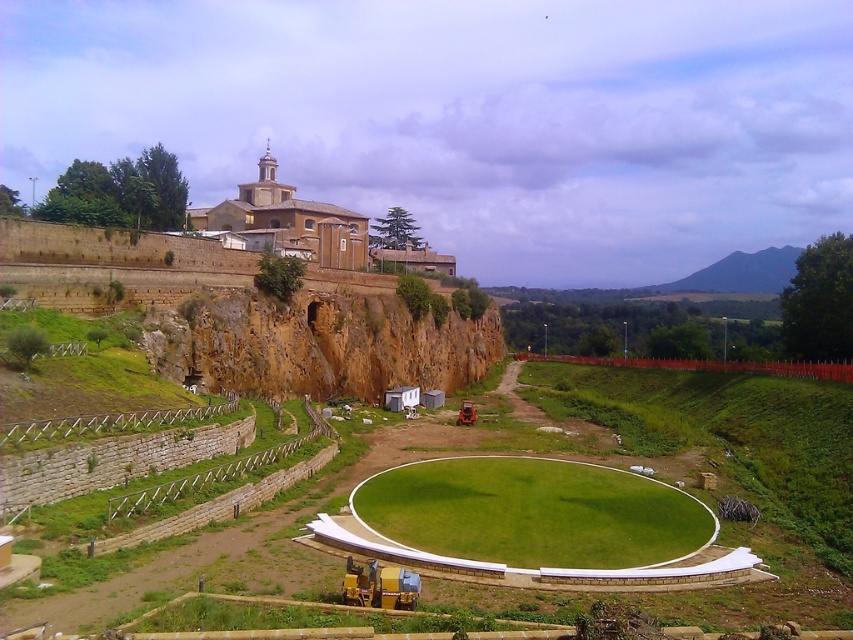
Question: Does brown stone cliff at upper center have a lesser width compared to smooth stone amphitheater at upper center?

Choices:
 (A) yes
 (B) no

Answer: (B)

Question: Which point is farther to the camera?

Choices:
 (A) (178, 376)
 (B) (316, 211)

Answer: (B)

Question: Does brown stone cliff at upper center have a greater width compared to smooth stone amphitheater at upper center?

Choices:
 (A) yes
 (B) no

Answer: (A)

Question: Which of the following is the closest to the observer?

Choices:
 (A) (329, 321)
 (B) (241, 220)

Answer: (A)

Question: Is brown stone cliff at upper center above smooth stone amphitheater at upper center?

Choices:
 (A) no
 (B) yes

Answer: (A)